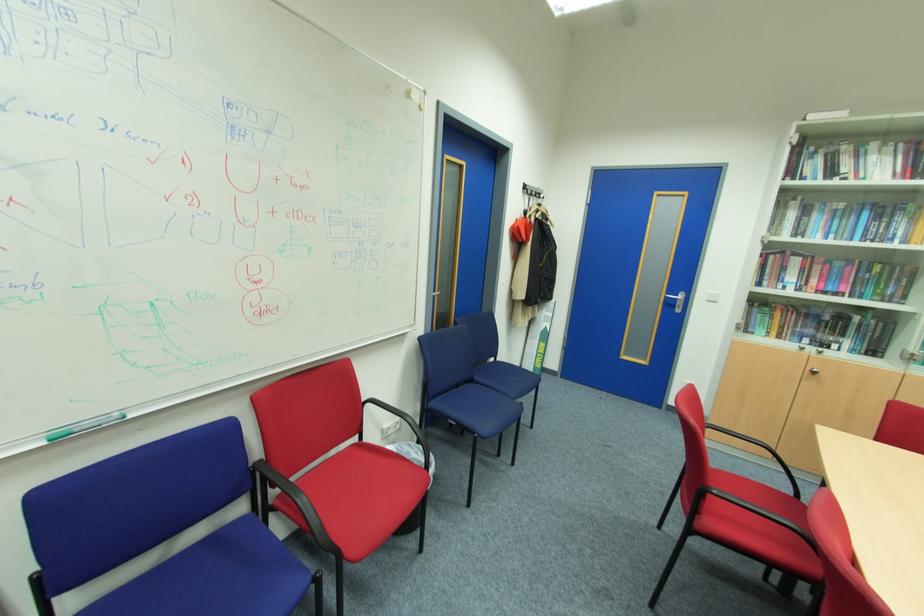
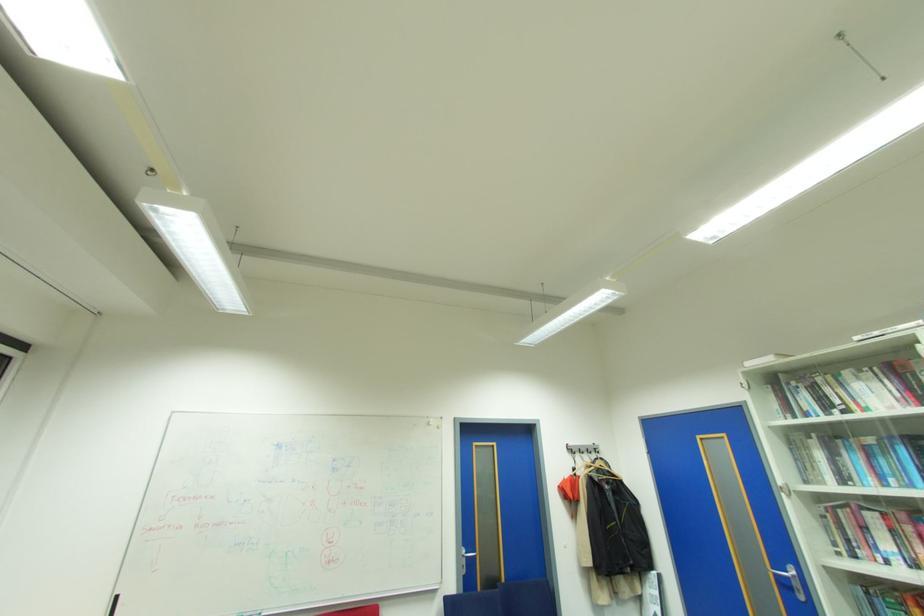
Find the pixel in the second image that matches point 531,187 in the first image.

(573, 448)